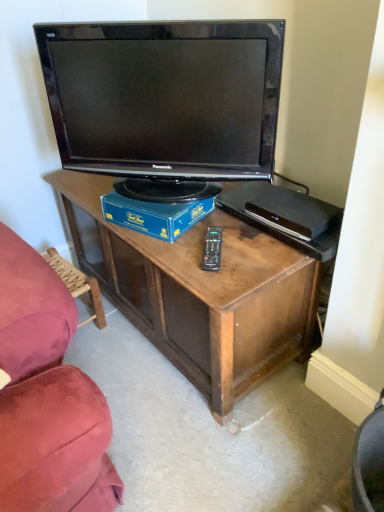
Where is `matte black television at center`? matte black television at center is located at coordinates (165, 97).

This screenshot has height=512, width=384. Describe the element at coordinates (78, 285) in the screenshot. I see `wooden swivel chair at lower left` at that location.

The width and height of the screenshot is (384, 512). Describe the element at coordinates (155, 215) in the screenshot. I see `blue cardboard box at center` at that location.

Locate an element on the screen. This screenshot has width=384, height=512. black plastic remote at center is located at coordinates (212, 249).

Between point (170, 220) and point (173, 153), which one is positioned behind?

The point (173, 153) is behind.

Is blue cardboard box at center facing towards matte black television at center?

No.

Considering the relative positions of blue cardboard box at center and matte black television at center in the image provided, is blue cardboard box at center to the left of matte black television at center from the viewer's perspective?

In fact, blue cardboard box at center is to the right of matte black television at center.

From the image's perspective, does blue cardboard box at center appear lower than matte black television at center?

Yes, from the image's perspective, blue cardboard box at center is beneath matte black television at center.

In terms of size, does black plastic remote at center appear bigger or smaller than blue cardboard box at center?

black plastic remote at center is smaller than blue cardboard box at center.

Is black plastic remote at center to the left of blue cardboard box at center from the viewer's perspective?

A: No.

Considering the relative positions of black plastic remote at center and blue cardboard box at center in the image provided, is black plastic remote at center behind blue cardboard box at center?

No.

Does black plastic remote at center turn towards blue cardboard box at center?

No.

Is matte black television at center aimed at blue cardboard box at center?

No, matte black television at center is not facing towards blue cardboard box at center.

In terms of size, does matte black television at center appear bigger or smaller than blue cardboard box at center?

matte black television at center is bigger than blue cardboard box at center.

Consider the image. From a real-world perspective, is matte black television at center positioned above or below blue cardboard box at center?

From a real-world perspective, matte black television at center is physically above blue cardboard box at center.

Would you say matte black television at center is a long distance from blue cardboard box at center?

Actually, matte black television at center and blue cardboard box at center are a little close together.

From a real-world perspective, between blue cardboard box at center and black plastic remote at center, who is vertically lower?

black plastic remote at center is physically lower.

Which is closer to the camera, (x=155, y=216) or (x=207, y=238)?

The point (x=207, y=238) is more forward.

Does blue cardboard box at center touch black plastic remote at center?

blue cardboard box at center and black plastic remote at center are clearly separated.

Does matte black television at center turn towards wooden swivel chair at lower left?

No, matte black television at center is not aimed at wooden swivel chair at lower left.

What are the coordinates of `swivel chair behind the matte black television at center` in the screenshot? It's located at (78, 285).

Can you confirm if matte black television at center is wider than wooden swivel chair at lower left?

No, matte black television at center is not wider than wooden swivel chair at lower left.

Is the depth of wooden swivel chair at lower left less than that of matte black television at center?

No, wooden swivel chair at lower left is further to the viewer.

Is wooden swivel chair at lower left positioned with its back to matte black television at center?

wooden swivel chair at lower left is not turned away from matte black television at center.

Image resolution: width=384 pixels, height=512 pixels. I want to click on television lying on the right of wooden swivel chair at lower left, so click(165, 97).

Considering the relative sizes of wooden swivel chair at lower left and matte black television at center in the image provided, is wooden swivel chair at lower left bigger than matte black television at center?

Actually, wooden swivel chair at lower left might be smaller than matte black television at center.

Where is `swivel chair below the black plastic remote at center (from a real-world perspective)`? swivel chair below the black plastic remote at center (from a real-world perspective) is located at coordinates [x=78, y=285].

Based on the photo, between wooden swivel chair at lower left and black plastic remote at center, which one appears on the left side from the viewer's perspective?

wooden swivel chair at lower left.

From a real-world perspective, relative to black plastic remote at center, is wooden swivel chair at lower left vertically above or below?

In terms of real-world spatial position, wooden swivel chair at lower left is below black plastic remote at center.

The height and width of the screenshot is (512, 384). Identify the location of box to the right of matte black television at center. (155, 215).

Identify the location of box above the black plastic remote at center (from a real-world perspective). Image resolution: width=384 pixels, height=512 pixels. (155, 215).

Estimate the real-world distances between objects in this image. Which object is further from matte black television at center, blue cardboard box at center or black plastic remote at center?

Based on the image, black plastic remote at center appears to be further to matte black television at center.

Looking at the image, which one is located further to black plastic remote at center, matte black television at center or blue cardboard box at center?

matte black television at center is positioned further to the anchor black plastic remote at center.

From the image, which object appears to be nearer to blue cardboard box at center, black plastic remote at center or wooden swivel chair at lower left?

Among the two, black plastic remote at center is located nearer to blue cardboard box at center.

When comparing their distances from blue cardboard box at center, does wooden swivel chair at lower left or matte black television at center seem further?

wooden swivel chair at lower left.

When comparing their distances from black plastic remote at center, does blue cardboard box at center or matte black television at center seem further?

matte black television at center is further to black plastic remote at center.

Looking at this image, looking at the image, which one is located further to matte black television at center, black plastic remote at center or wooden swivel chair at lower left?

Based on the image, wooden swivel chair at lower left appears to be further to matte black television at center.

Based on their spatial positions, is matte black television at center or blue cardboard box at center closer to wooden swivel chair at lower left?

blue cardboard box at center.

Considering their positions, is matte black television at center positioned closer to blue cardboard box at center than black plastic remote at center?

Among the two, black plastic remote at center is located nearer to blue cardboard box at center.

Identify the location of box that lies between matte black television at center and black plastic remote at center from top to bottom. (155, 215).

In order to click on box between matte black television at center and wooden swivel chair at lower left in the vertical direction in this screenshot , I will do `click(155, 215)`.

The width and height of the screenshot is (384, 512). I want to click on television located between wooden swivel chair at lower left and black plastic remote at center in the left-right direction, so click(165, 97).

At what (x,y) coordinates should I click in order to perform the action: click on box between wooden swivel chair at lower left and black plastic remote at center. Please return your answer as a coordinate pair (x, y). This screenshot has width=384, height=512. Looking at the image, I should click on (155, 215).